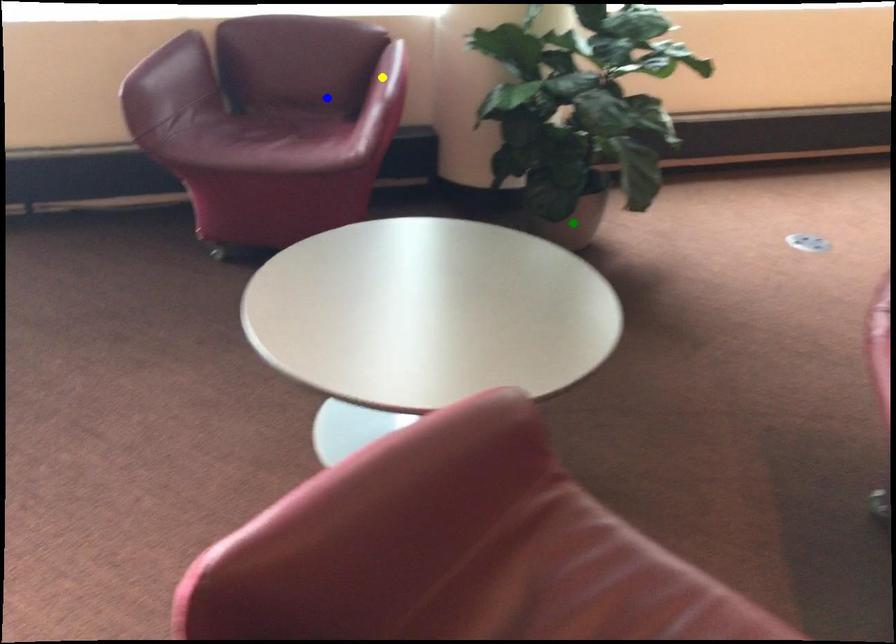
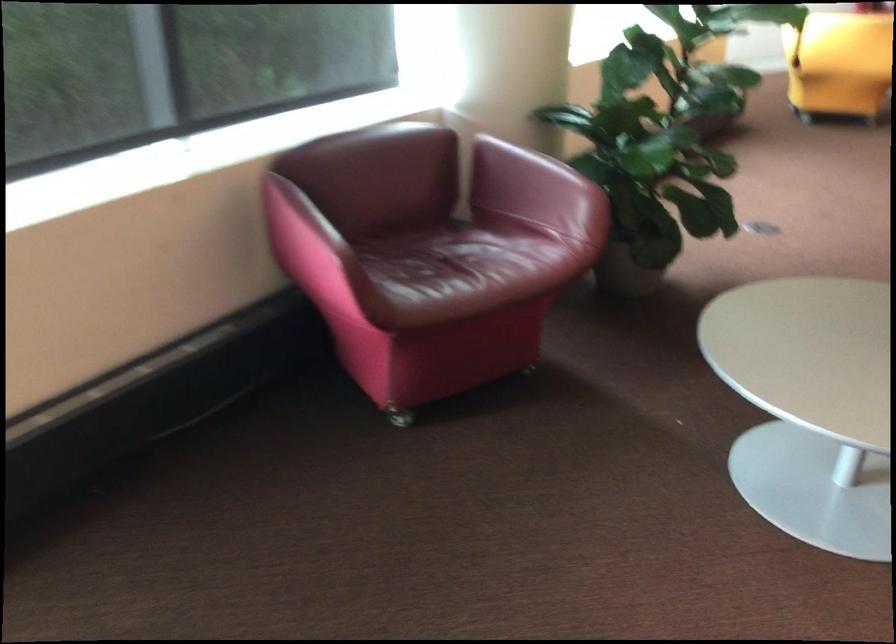
I am providing you with two images of the same scene from different viewpoints. Three points are marked in image1. Which point corresponds to a part or object that is occluded in image2?In image1, three points are marked. Which of them correspond to a part or object that is occluded in image2?Among the three points shown in image1, which one corresponds to a part or object that is no longer visible due to occlusion in image2?

green point